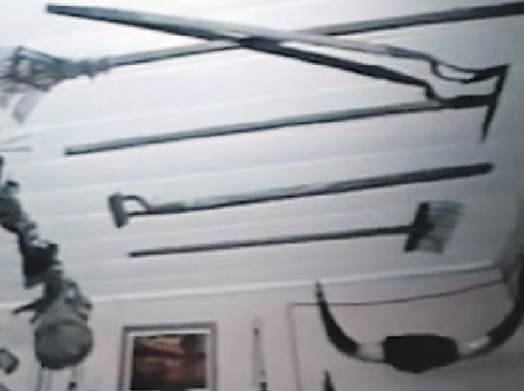
Find the location of `framed picture bottom left`. framed picture bottom left is located at coordinates click(x=163, y=360).